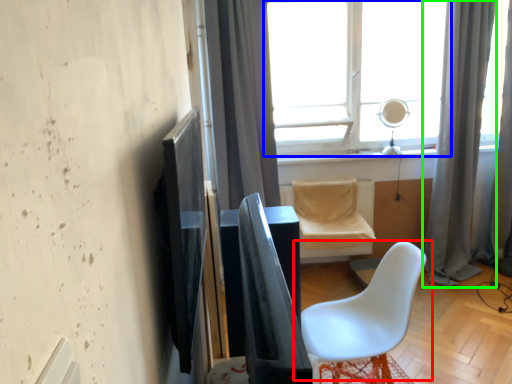
Question: Which is farther away from chair (highlighted by a red box)? window (highlighted by a blue box) or curtain (highlighted by a green box)?

Choices:
 (A) window
 (B) curtain

Answer: (A)